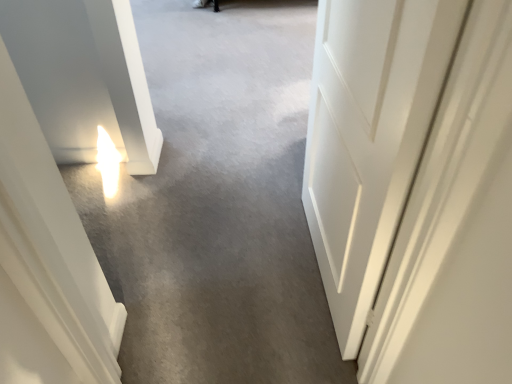
What is the approximate width of gray carpet at center?

The width of gray carpet at center is 32.66 inches.

Describe the element at coordinates (218, 204) in the screenshot. I see `gray carpet at center` at that location.

Locate an element on the screen. The width and height of the screenshot is (512, 384). gray carpet at center is located at coordinates (218, 204).

Find the location of a particular element. gray carpet at center is located at coordinates (218, 204).